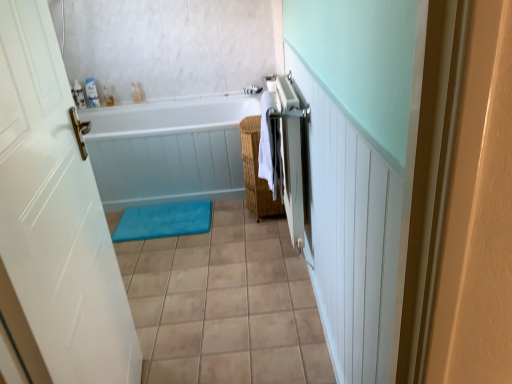
Question: Is white glossy door at left at the back of clear plastic bottle at upper left?

Choices:
 (A) yes
 (B) no

Answer: (B)

Question: Is clear plastic bottle at upper left positioned far away from white glossy door at left?

Choices:
 (A) yes
 (B) no

Answer: (A)

Question: From a real-world perspective, is clear plastic bottle at upper left positioned under white glossy door at left based on gravity?

Choices:
 (A) no
 (B) yes

Answer: (B)

Question: Does clear plastic bottle at upper left have a greater width compared to white glossy door at left?

Choices:
 (A) yes
 (B) no

Answer: (B)

Question: From the image's perspective, would you say clear plastic bottle at upper left is positioned over white glossy door at left?

Choices:
 (A) yes
 (B) no

Answer: (A)

Question: Is clear plastic bottle at upper left positioned behind white glossy door at left?

Choices:
 (A) no
 (B) yes

Answer: (B)

Question: From a real-world perspective, does blue soft bath mat at center sit lower than clear plastic bottle at upper left?

Choices:
 (A) yes
 (B) no

Answer: (A)

Question: Are blue soft bath mat at center and clear plastic bottle at upper left located far from each other?

Choices:
 (A) yes
 (B) no

Answer: (A)

Question: Is blue soft bath mat at center shorter than clear plastic bottle at upper left?

Choices:
 (A) yes
 (B) no

Answer: (A)

Question: Is the depth of blue soft bath mat at center greater than that of clear plastic bottle at upper left?

Choices:
 (A) no
 (B) yes

Answer: (A)

Question: Does blue soft bath mat at center have a smaller size compared to clear plastic bottle at upper left?

Choices:
 (A) no
 (B) yes

Answer: (A)

Question: Does blue soft bath mat at center appear on the left side of clear plastic bottle at upper left?

Choices:
 (A) yes
 (B) no

Answer: (B)

Question: Can you confirm if white glossy door at left is taller than silver metallic towel rack at right?

Choices:
 (A) no
 (B) yes

Answer: (B)